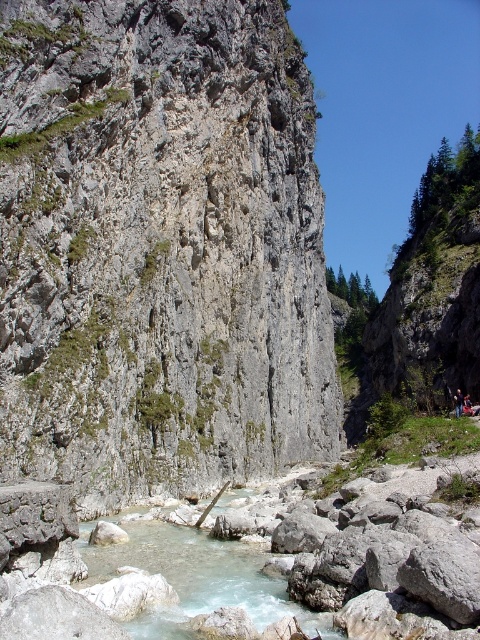
You are standing at the point marked as point (158, 248) in the rugged landscape. Based on the scene description, what type of terrain are you currently on?

The point (158, 248) is on gray rough rock at center, so you are standing on a gray rough rock terrain.

Consider the image. You are standing at the base of the cliff on the left side of the image and want to take a photo of both point (214, 330) and point (93, 557). Which point will appear closer to the camera in your photo?

Point (93, 557) will appear closer to the camera in the photo because it is physically closer to the camera than point (214, 330), which is further away.

You are a geologist examining the landscape. You observe the gray rough rock at center and the clear quartz water at center. Which object occupies a wider area in the scene?

The gray rough rock at center has a larger width than the clear quartz water at center, so the gray rough rock at center occupies a wider area in the scene.